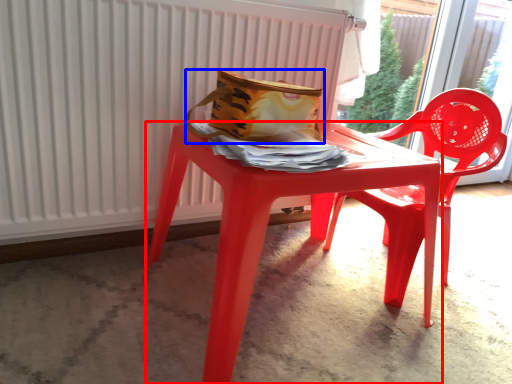
Question: Which object appears farthest to the camera in this image, table (highlighted by a red box) or bag (highlighted by a blue box)?

Choices:
 (A) table
 (B) bag

Answer: (B)